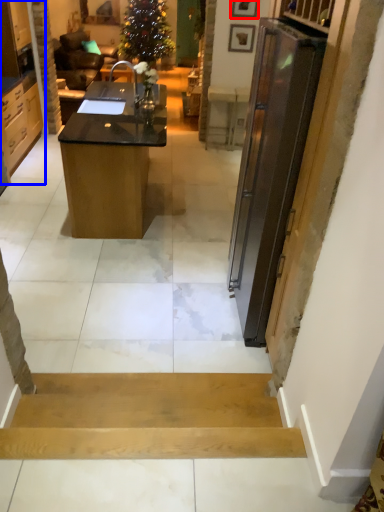
Question: Which of the following is the closest to the observer, picture frame (highlighted by a red box) or cabinetry (highlighted by a blue box)?

Choices:
 (A) picture frame
 (B) cabinetry

Answer: (B)